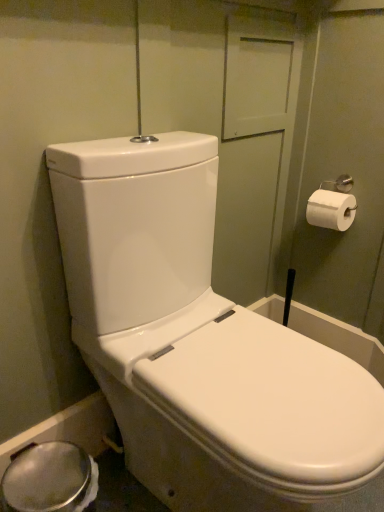
Measure the distance between point (x=341, y=211) and camera.

The distance of point (x=341, y=211) from camera is 1.30 meters.

What do you see at coordinates (331, 210) in the screenshot? This screenshot has width=384, height=512. I see `white paper at upper right` at bounding box center [331, 210].

At what (x,y) coordinates should I click in order to perform the action: click on white paper at upper right. Please return your answer as a coordinate pair (x, y). This screenshot has width=384, height=512. Looking at the image, I should click on (331, 210).

What do you see at coordinates (198, 341) in the screenshot?
I see `white glossy toilet at center` at bounding box center [198, 341].

Locate an element on the screen. The width and height of the screenshot is (384, 512). white glossy toilet at center is located at coordinates coord(198,341).

What are the coordinates of `white paper at upper right` in the screenshot? It's located at (331, 210).

Which is more to the left, white glossy toilet at center or white paper at upper right?

white glossy toilet at center is more to the left.

Is the position of white glossy toilet at center less distant than that of white paper at upper right?

Yes, it is in front of white paper at upper right.

Is point (128, 352) closer or farther from the camera than point (345, 206)?

Clearly, point (128, 352) is closer to the camera than point (345, 206).

From the image's perspective, which is above, white glossy toilet at center or white paper at upper right?

white paper at upper right is shown above in the image.

From a real-world perspective, is white glossy toilet at center located higher than white paper at upper right?

No, from a real-world perspective, white glossy toilet at center is not on top of white paper at upper right.

Is white glossy toilet at center wider than white paper at upper right?

Indeed, white glossy toilet at center has a greater width compared to white paper at upper right.

Considering the sizes of white glossy toilet at center and white paper at upper right in the image, is white glossy toilet at center taller or shorter than white paper at upper right?

white glossy toilet at center is taller than white paper at upper right.

Between white glossy toilet at center and white paper at upper right, which one has larger size?

With larger size is white glossy toilet at center.

Is white glossy toilet at center not inside white paper at upper right?

white glossy toilet at center lies outside white paper at upper right's area.

Is white glossy toilet at center directly adjacent to white paper at upper right?

No.

Is white glossy toilet at center positioned with its back to white paper at upper right?

No, white glossy toilet at center's orientation is not away from white paper at upper right.

How different are the orientations of white glossy toilet at center and white paper at upper right in degrees?

There is a 89.5-degree angle between the facing directions of white glossy toilet at center and white paper at upper right.

At what (x,y) coordinates should I click in order to perform the action: click on toilet that is on the left side of white paper at upper right. Please return your answer as a coordinate pair (x, y). Image resolution: width=384 pixels, height=512 pixels. Looking at the image, I should click on (198, 341).

In the scene shown: Can you confirm if white paper at upper right is positioned to the right of white glossy toilet at center?

Yes.

Is the depth of white paper at upper right greater than that of white glossy toilet at center?

Yes, it is behind white glossy toilet at center.

Which point is more distant from viewer, (338, 214) or (233, 340)?

The point (338, 214) is more distant.

From the image's perspective, is white paper at upper right located above or below white glossy toilet at center?

white paper at upper right is situated higher than white glossy toilet at center in the image.

From a real-world perspective, between white paper at upper right and white glossy toilet at center, who is vertically higher?

From a 3D spatial view, white paper at upper right is above.

Based on the photo, can you confirm if white paper at upper right is wider than white glossy toilet at center?

In fact, white paper at upper right might be narrower than white glossy toilet at center.

Consider the image. Can you confirm if white paper at upper right is taller than white glossy toilet at center?

No, white paper at upper right is not taller than white glossy toilet at center.

Is white paper at upper right bigger or smaller than white glossy toilet at center?

white paper at upper right is smaller than white glossy toilet at center.

Is white paper at upper right located outside white glossy toilet at center?

That's correct, white paper at upper right is outside of white glossy toilet at center.

Is white paper at upper right beside white glossy toilet at center?

white paper at upper right and white glossy toilet at center are clearly separated.

Is white paper at upper right oriented away from white glossy toilet at center?

No, white paper at upper right is not facing away from white glossy toilet at center.

How different are the orientations of white paper at upper right and white glossy toilet at center in degrees?

89.5 degrees.

How distant is white paper at upper right from white glossy toilet at center?

white paper at upper right and white glossy toilet at center are 27.06 inches apart.

This screenshot has height=512, width=384. In order to click on toilet located below the white paper at upper right (from the image's perspective) in this screenshot , I will do `click(198, 341)`.

At what (x,y) coordinates should I click in order to perform the action: click on toilet paper that is above the white glossy toilet at center (from a real-world perspective). Please return your answer as a coordinate pair (x, y). The image size is (384, 512). Looking at the image, I should click on (331, 210).

In the image, there is a white paper at upper right. In order to click on toilet below it (from a real-world perspective) in this screenshot , I will do `click(198, 341)`.